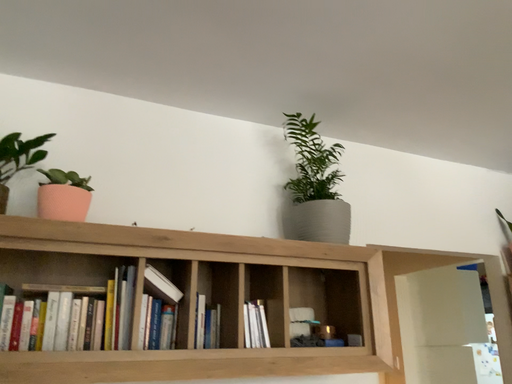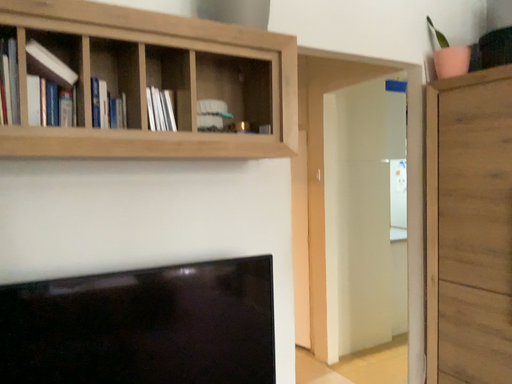
Question: How did the camera likely rotate when shooting the video?

Choices:
 (A) rotated right
 (B) rotated left

Answer: (A)